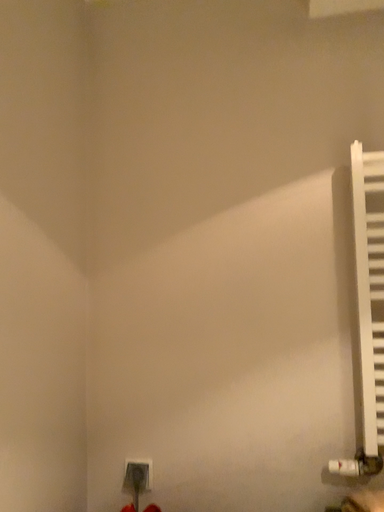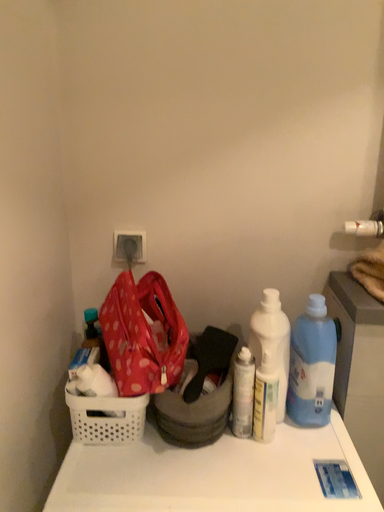
Question: How did the camera likely rotate when shooting the video?

Choices:
 (A) rotated upward
 (B) rotated downward

Answer: (B)